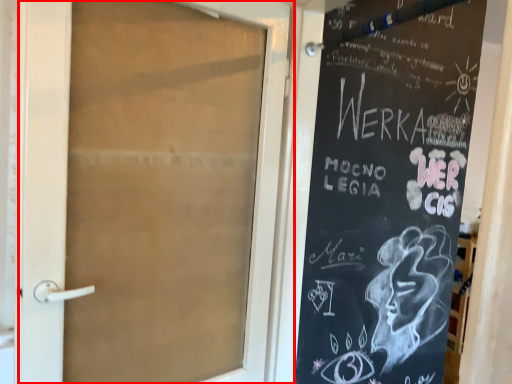
Question: Where is door (annotated by the red box) located in relation to bulletin board in the image?

Choices:
 (A) right
 (B) left

Answer: (B)